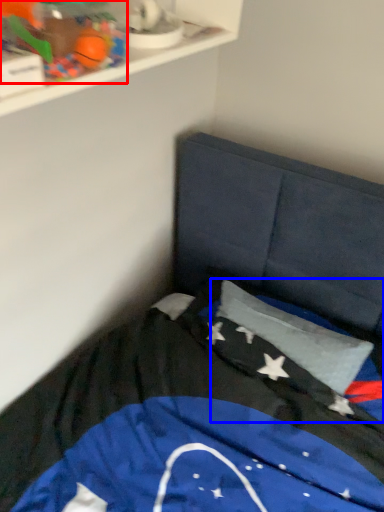
Question: Which of the following is the closest to the observer, toy (highlighted by a red box) or flag (highlighted by a blue box)?

Choices:
 (A) toy
 (B) flag

Answer: (A)